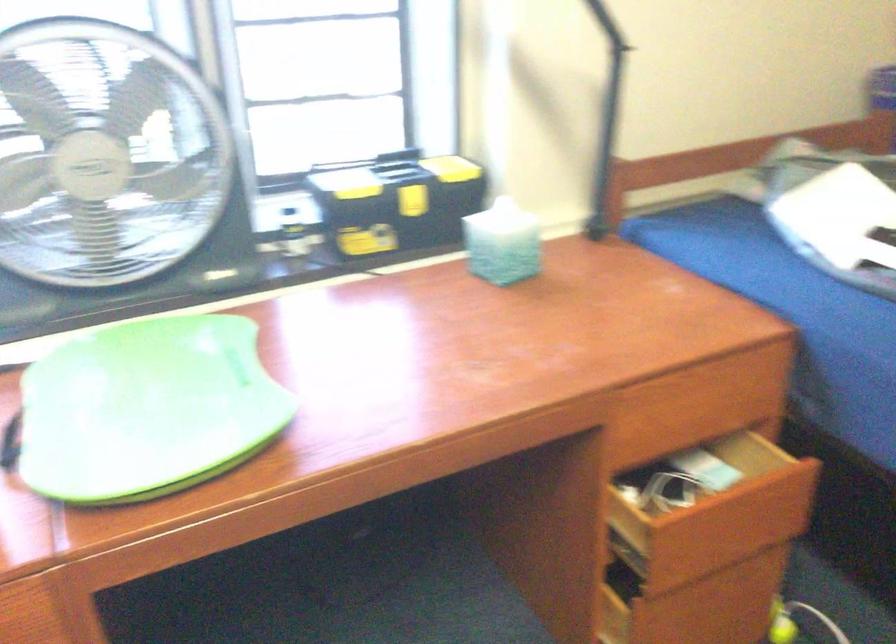
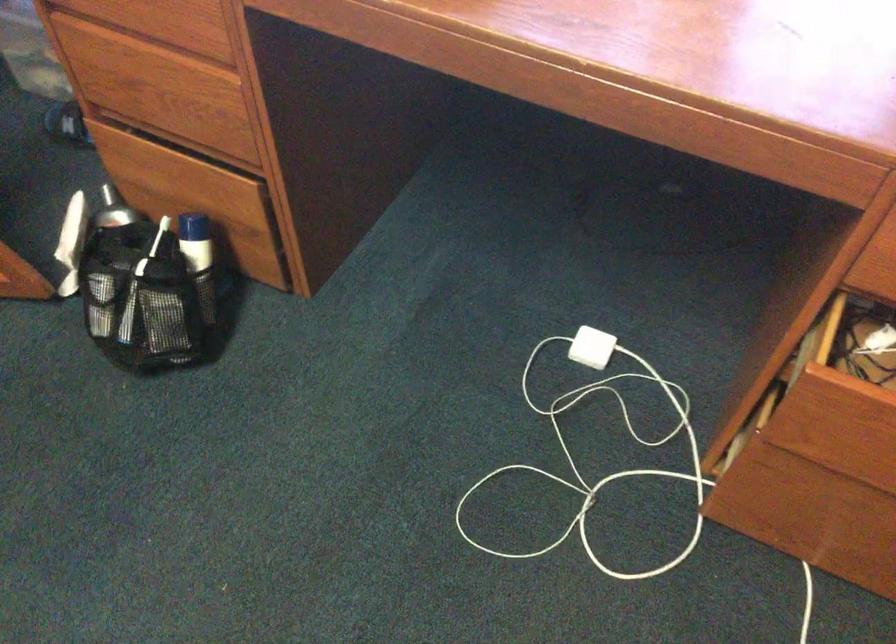
Looking at this image, the images are taken continuously from a first-person perspective. In which direction is your viewpoint rotating?

The camera rotated toward left-down.